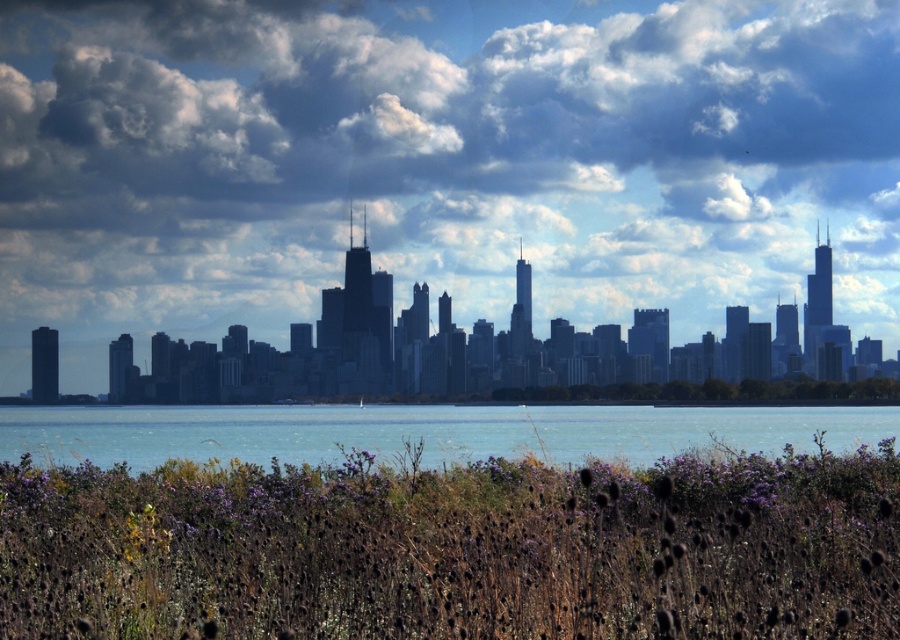
Does cloudy sky at upper center appear over purple dry grass at lower center?

Correct, cloudy sky at upper center is located above purple dry grass at lower center.

Which is above, cloudy sky at upper center or purple dry grass at lower center?

Positioned higher is cloudy sky at upper center.

In order to click on cloudy sky at upper center in this screenshot , I will do `click(441, 157)`.

Identify the location of cloudy sky at upper center. This screenshot has width=900, height=640. (441, 157).

Can you confirm if cloudy sky at upper center is positioned to the right of blue water at center?

In fact, cloudy sky at upper center is to the left of blue water at center.

Who is higher up, cloudy sky at upper center or blue water at center?

cloudy sky at upper center is higher up.

Image resolution: width=900 pixels, height=640 pixels. What do you see at coordinates (441, 157) in the screenshot?
I see `cloudy sky at upper center` at bounding box center [441, 157].

This screenshot has height=640, width=900. Find the location of `cloudy sky at upper center`. cloudy sky at upper center is located at coordinates (441, 157).

Measure the distance between purple dry grass at lower center and blue water at center.

A distance of 171.73 meters exists between purple dry grass at lower center and blue water at center.

At what (x,y) coordinates should I click in order to perform the action: click on purple dry grass at lower center. Please return your answer as a coordinate pair (x, y). The height and width of the screenshot is (640, 900). Looking at the image, I should click on coord(454,548).

Who is more forward, [630,493] or [635,438]?

Point [630,493]

Where is `purple dry grass at lower center`? The height and width of the screenshot is (640, 900). purple dry grass at lower center is located at coordinates (454, 548).